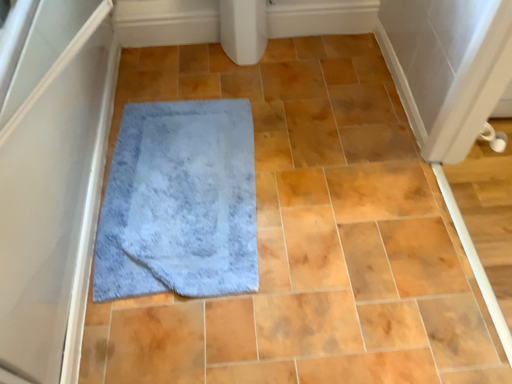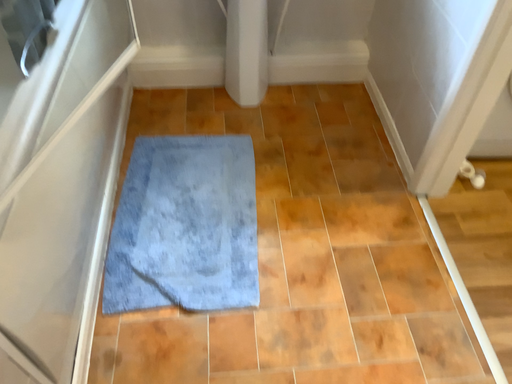
Question: How did the camera likely rotate when shooting the video?

Choices:
 (A) rotated upward
 (B) rotated downward

Answer: (A)